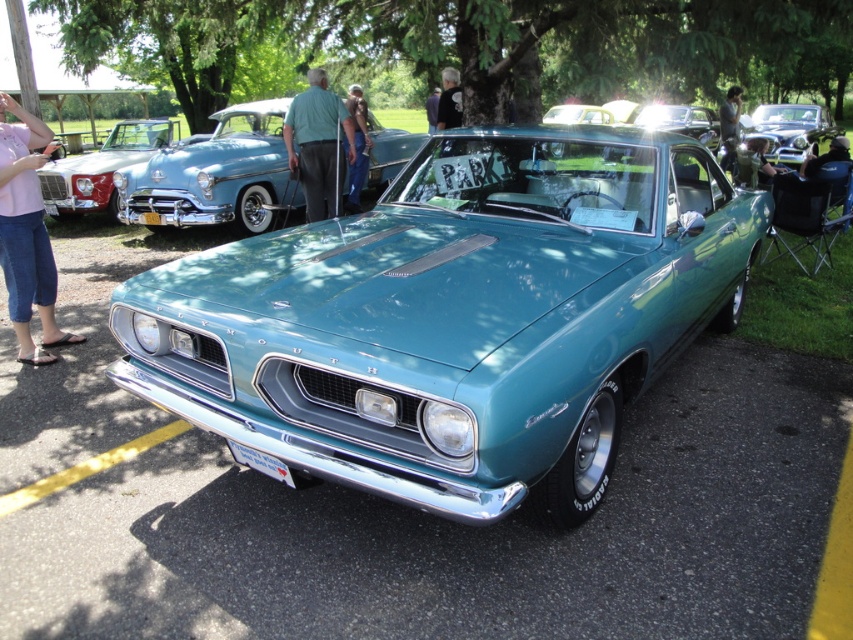
You are a photographer at the car show and want to capture the dark gray shirt at center and the matte black jacket at center in a single shot. Since both are at the center, can you tell me which one is closer to the camera?

The dark gray shirt at center is located above the matte black jacket at center, so it is closer to the camera.

You are a photographer at the car show and want to take a photo of the teal glossy sedan at center and the matte black jacket at center. Which object will appear larger in the photo?

The teal glossy sedan at center will appear larger in the photo because it is closer to the viewer than the matte black jacket at center.